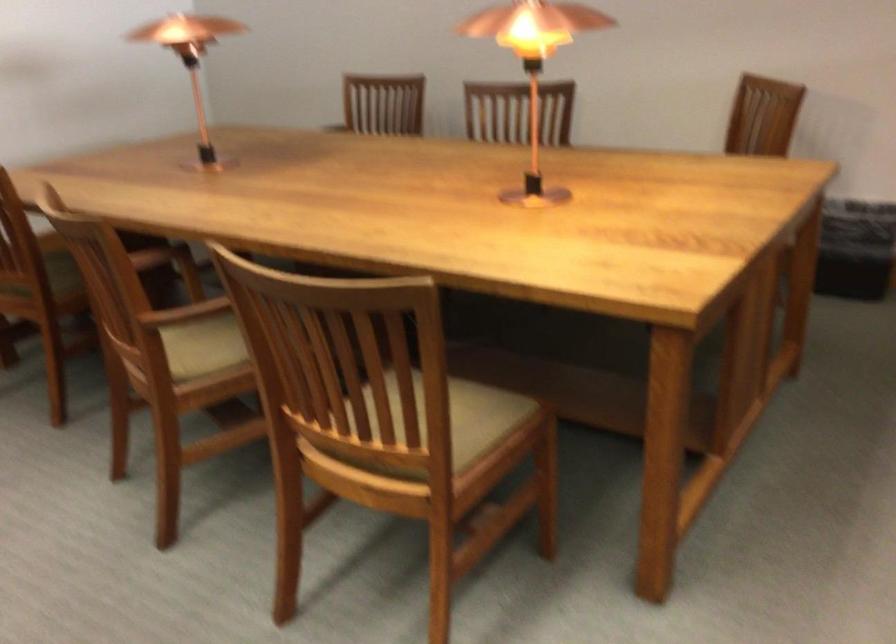
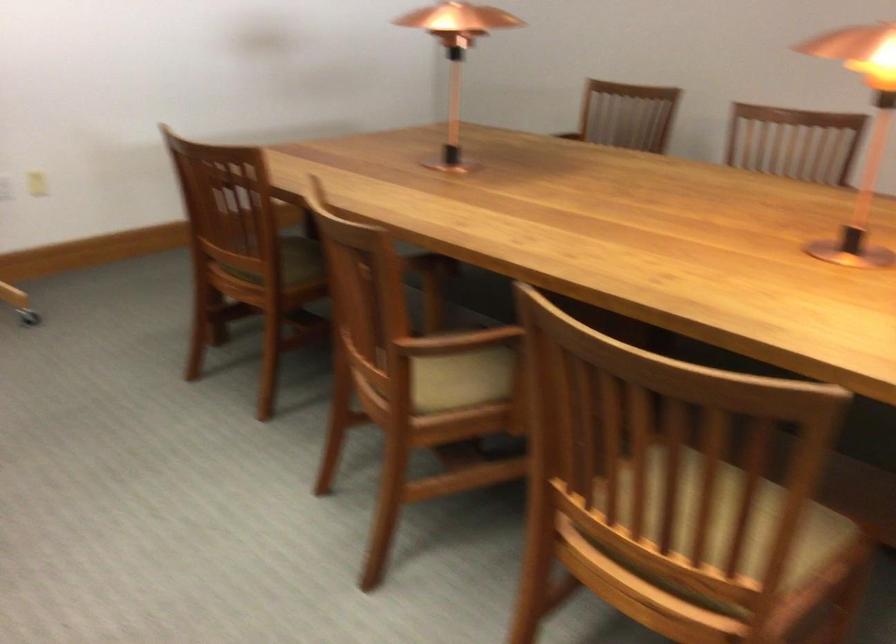
In the second image, find the point that corresponds to (402,409) in the first image.

(728, 526)